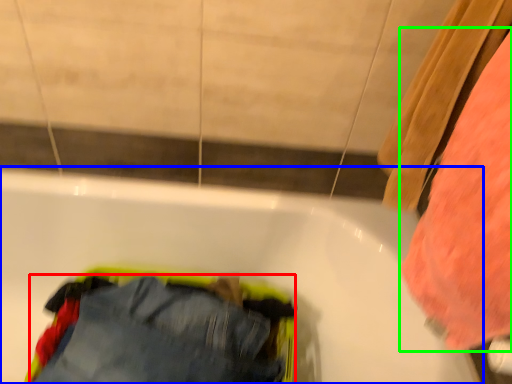
Question: Estimate the real-world distances between objects in this image. Which object is closer to trousers (highlighted by a red box), bathtub (highlighted by a blue box) or clothing (highlighted by a green box)?

Choices:
 (A) bathtub
 (B) clothing

Answer: (A)